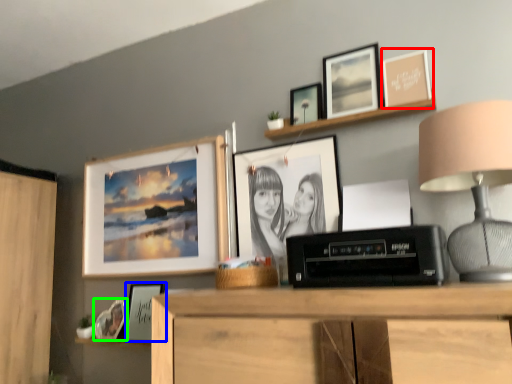
Question: Which is nearer to the picture frame (highlighted by a red box)? picture frame (highlighted by a blue box) or picture frame (highlighted by a green box).

Choices:
 (A) picture frame
 (B) picture frame

Answer: (A)